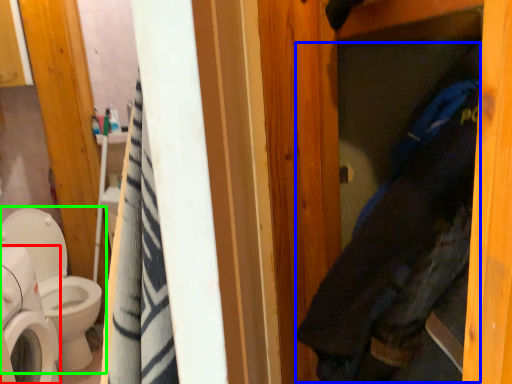
Question: Estimate the real-world distances between objects in this image. Which object is farther from washing machine (highlighted by a red box), clothing (highlighted by a blue box) or toilet (highlighted by a green box)?

Choices:
 (A) clothing
 (B) toilet

Answer: (A)